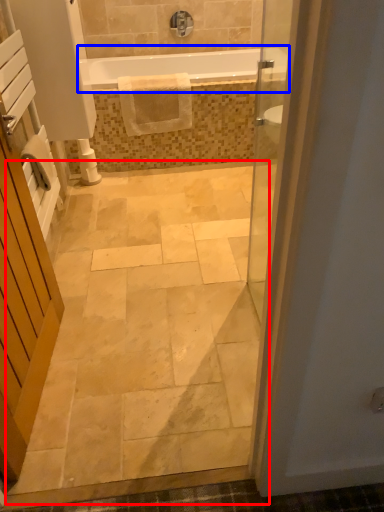
Question: Which object appears farthest to the camera in this image, path (highlighted by a red box) or bathtub (highlighted by a blue box)?

Choices:
 (A) path
 (B) bathtub

Answer: (B)